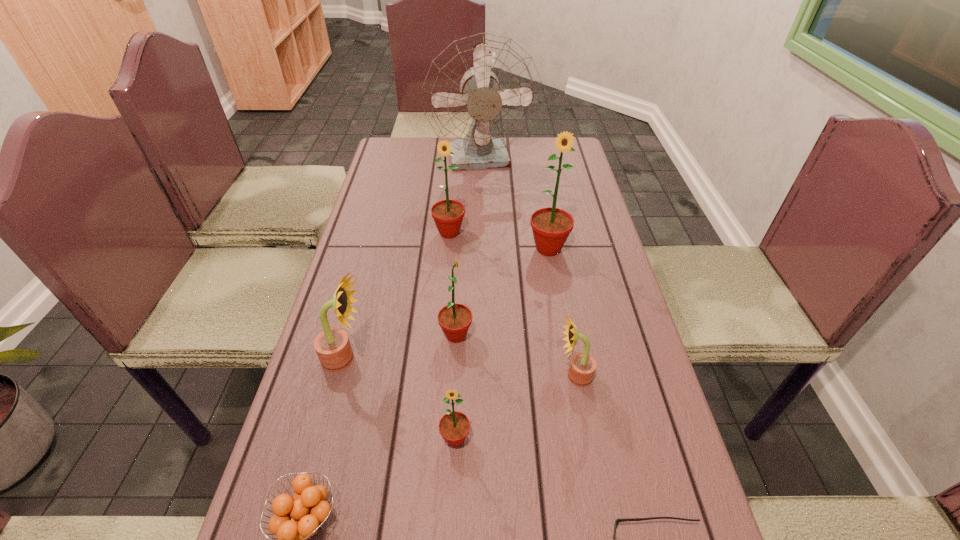
The width and height of the screenshot is (960, 540). Identify the location of the smallest green sunflower. (454, 426).

Image resolution: width=960 pixels, height=540 pixels. What are the coordinates of `the nearest sunflower` in the screenshot? It's located at (454, 426).

The image size is (960, 540). Identify the location of blank space located 0.210m in front of the farthest object to blow air. (483, 218).

This screenshot has width=960, height=540. Identify the location of vacant region located 0.350m on the face of the tallest sunflower. (569, 371).

Locate an element on the screen. This screenshot has width=960, height=540. vacant space located on the face of the seventh shortest object is located at coordinates (447, 262).

Identify the location of vacant point located on the face of the bigger yellow sunflower. The height and width of the screenshot is (540, 960). (444, 359).

At what (x,y) coordinates should I click in order to perform the action: click on blank space located on the face of the second smallest green sunflower. Please return your answer as a coordinate pair (x, y). This screenshot has width=960, height=540. Looking at the image, I should click on click(633, 335).

At what (x,y) coordinates should I click in order to perform the action: click on vacant space located on the face of the smaller yellow sunflower. Please return your answer as a coordinate pair (x, y). Looking at the image, I should click on (515, 376).

This screenshot has height=540, width=960. In order to click on free space located 0.340m on the face of the smaller yellow sunflower in this screenshot , I will do `click(397, 376)`.

This screenshot has height=540, width=960. I want to click on free space located on the face of the smaller yellow sunflower, so click(x=449, y=376).